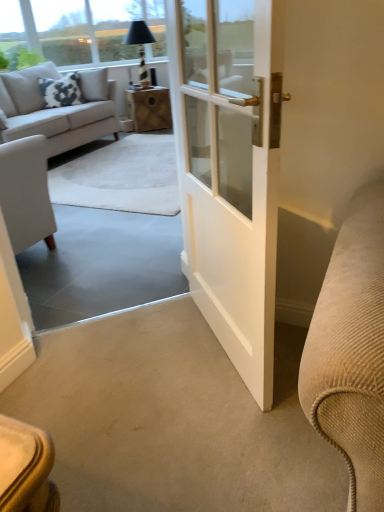
In order to face black glass lamp at upper center, should I rotate leftwards or rightwards?

Turn left by 7.124 degrees to look at black glass lamp at upper center.

What is the approximate width of white cotton pillow at upper left?

white cotton pillow at upper left is 13.64 inches wide.

The width and height of the screenshot is (384, 512). In order to click on wooden box at center in this screenshot , I will do `click(149, 108)`.

This screenshot has width=384, height=512. In order to click on black glass lamp at upper center in this screenshot , I will do `click(140, 46)`.

Is light gray fabric couch at upper left wider than transparent glass window screen at upper left?

Indeed, light gray fabric couch at upper left has a greater width compared to transparent glass window screen at upper left.

From the image's perspective, is light gray fabric couch at upper left below transparent glass window screen at upper left?

Yes.

From a real-world perspective, between light gray fabric couch at upper left and transparent glass window screen at upper left, who is vertically lower?

light gray fabric couch at upper left.

Is light gray fabric couch at upper left in contact with transparent glass window screen at upper left?

No, light gray fabric couch at upper left is not next to transparent glass window screen at upper left.

You are a GUI agent. You are given a task and a screenshot of the screen. Output one action in this format:
    pyautogui.click(x=<x>, y=<y>)
    Task: Click on the lamp above the light gray fabric couch at upper left (from the image's perspective)
    The width and height of the screenshot is (384, 512).
    Given the screenshot: What is the action you would take?
    pyautogui.click(x=140, y=46)

Choose the correct answer: Is black glass lamp at upper center inside light gray fabric couch at upper left or outside it?

black glass lamp at upper center lies outside light gray fabric couch at upper left.

Who is taller, black glass lamp at upper center or light gray fabric couch at upper left?

light gray fabric couch at upper left.

Could you tell me if wooden box at center is facing white cotton pillow at upper left?

No, wooden box at center is not aimed at white cotton pillow at upper left.

From a real-world perspective, relative to white cotton pillow at upper left, is wooden box at center vertically above or below?

wooden box at center is situated lower than white cotton pillow at upper left in the real world.

Is wooden box at center next to white cotton pillow at upper left?

No, wooden box at center is not next to white cotton pillow at upper left.

How many degrees apart are the facing directions of white cotton pillow at upper left and transparent glass window screen at upper left?

They differ by 0.203 degrees in their facing directions.

Identify the location of window screen that appears above the white cotton pillow at upper left (from a real-world perspective). This screenshot has height=512, width=384. (79, 29).

From the image's perspective, is white cotton pillow at upper left under transparent glass window screen at upper left?

Yes, from the image's perspective, white cotton pillow at upper left is below transparent glass window screen at upper left.

Looking at this image, is white cotton pillow at upper left surrounding transparent glass window screen at upper left?

No, transparent glass window screen at upper left is not inside white cotton pillow at upper left.

Between black glass lamp at upper center and transparent glass window screen at upper left, which one has smaller width?

With smaller width is transparent glass window screen at upper left.

Which of these two, black glass lamp at upper center or transparent glass window screen at upper left, is bigger?

black glass lamp at upper center is bigger.

Is transparent glass window screen at upper left at the back of black glass lamp at upper center?

Yes, black glass lamp at upper center is facing away from transparent glass window screen at upper left.

In the scene shown: Relative to black glass lamp at upper center, is light gray fabric couch at upper left in front or behind?

In the image, light gray fabric couch at upper left appears in front of black glass lamp at upper center.

Is point (86, 129) closer or farther from the camera than point (143, 78)?

Point (86, 129) appears to be closer to the viewer than point (143, 78).

Is light gray fabric couch at upper left aimed at black glass lamp at upper center?

No.

Consider the image. Considering the relative sizes of light gray fabric couch at upper left and black glass lamp at upper center in the image provided, is light gray fabric couch at upper left bigger than black glass lamp at upper center?

Indeed, light gray fabric couch at upper left has a larger size compared to black glass lamp at upper center.

Is wooden box at center situated inside light gray fabric couch at upper left or outside?

wooden box at center is not enclosed by light gray fabric couch at upper left.

Between wooden box at center and light gray fabric couch at upper left, which one has smaller width?

Thinner between the two is wooden box at center.

From the picture: Is wooden box at center not close to light gray fabric couch at upper left?

No, wooden box at center is not far from light gray fabric couch at upper left.

The image size is (384, 512). Find the location of `window screen on the right of light gray fabric couch at upper left`. window screen on the right of light gray fabric couch at upper left is located at coordinates (79, 29).

You are a GUI agent. You are given a task and a screenshot of the screen. Output one action in this format:
    pyautogui.click(x=<x>, y=<y>)
    Task: Click on the studio couch below the black glass lamp at upper center (from the image's perspective)
    The image size is (384, 512).
    Given the screenshot: What is the action you would take?
    pyautogui.click(x=58, y=109)

Looking at the image, which one is located closer to transparent glass window screen at upper left, white cotton pillow at upper left or light gray fabric couch at upper left?

light gray fabric couch at upper left lies closer to transparent glass window screen at upper left than the other object.

Looking at the image, which one is located further to black glass lamp at upper center, light gray fabric couch at upper left or wooden box at center?

light gray fabric couch at upper left is further to black glass lamp at upper center.

In the scene shown: From the image, which object appears to be farther from transparent glass window screen at upper left, black glass lamp at upper center or light gray fabric couch at upper left?

light gray fabric couch at upper left is positioned further to the anchor transparent glass window screen at upper left.

Looking at this image, from the image, which object appears to be farther from transparent glass window screen at upper left, white cotton pillow at upper left or wooden box at center?

Among the two, wooden box at center is located further to transparent glass window screen at upper left.

Looking at the image, which one is located closer to transparent glass window screen at upper left, wooden box at center or white cotton pillow at upper left?

white cotton pillow at upper left lies closer to transparent glass window screen at upper left than the other object.

Looking at this image, when comparing their distances from light gray fabric couch at upper left, does transparent glass window screen at upper left or white cotton pillow at upper left seem further?

transparent glass window screen at upper left is further to light gray fabric couch at upper left.

When comparing their distances from wooden box at center, does black glass lamp at upper center or light gray fabric couch at upper left seem closer?

The object closer to wooden box at center is black glass lamp at upper center.

When comparing their distances from black glass lamp at upper center, does white cotton pillow at upper left or wooden box at center seem closer?

The object closer to black glass lamp at upper center is wooden box at center.

What are the coordinates of `lamp located between white cotton pillow at upper left and wooden box at center in the left-right direction` in the screenshot? It's located at (140, 46).

This screenshot has width=384, height=512. In order to click on pillow located between light gray fabric couch at upper left and wooden box at center in the depth direction in this screenshot , I will do `click(61, 91)`.

At what (x,y) coordinates should I click in order to perform the action: click on lamp between transparent glass window screen at upper left and wooden box at center in the vertical direction. Please return your answer as a coordinate pair (x, y). This screenshot has width=384, height=512. Looking at the image, I should click on (140, 46).

This screenshot has width=384, height=512. I want to click on pillow located between light gray fabric couch at upper left and black glass lamp at upper center in the depth direction, so click(61, 91).